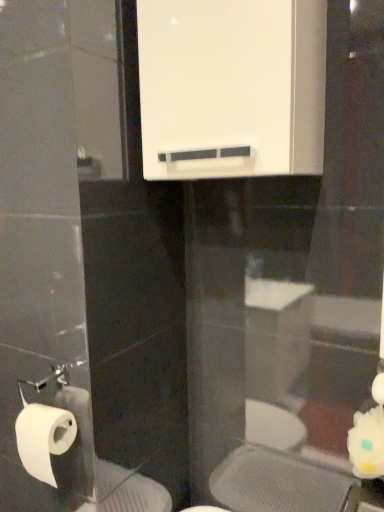
Question: Looking at the image, does white matte toilet paper at lower left seem bigger or smaller compared to white glossy medicine cabinet at upper center?

Choices:
 (A) big
 (B) small

Answer: (B)

Question: Considering the positions of white matte toilet paper at lower left and white glossy medicine cabinet at upper center in the image, is white matte toilet paper at lower left taller or shorter than white glossy medicine cabinet at upper center?

Choices:
 (A) tall
 (B) short

Answer: (B)

Question: Visually, is white matte toilet paper at lower left positioned to the left or to the right of white glossy medicine cabinet at upper center?

Choices:
 (A) left
 (B) right

Answer: (A)

Question: Is white glossy medicine cabinet at upper center bigger or smaller than white matte toilet paper at lower left?

Choices:
 (A) small
 (B) big

Answer: (B)

Question: Is white glossy medicine cabinet at upper center inside or outside of white matte toilet paper at lower left?

Choices:
 (A) inside
 (B) outside

Answer: (B)

Question: From a real-world perspective, is white glossy medicine cabinet at upper center physically located above or below white matte toilet paper at lower left?

Choices:
 (A) below
 (B) above

Answer: (B)

Question: Is white glossy medicine cabinet at upper center wider or thinner than white matte toilet paper at lower left?

Choices:
 (A) thin
 (B) wide

Answer: (B)